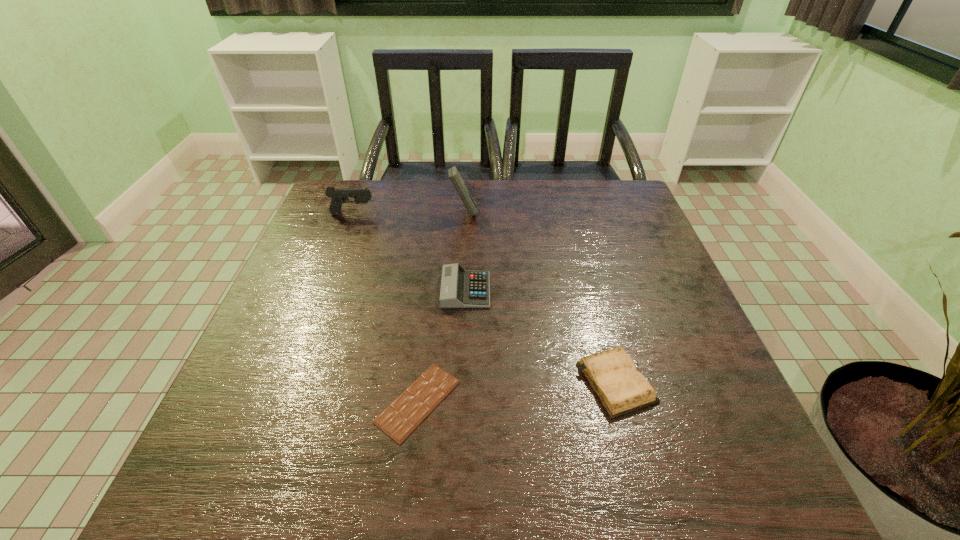
Where is `free space between the chocolate bar and the third tallest object`? This screenshot has height=540, width=960. free space between the chocolate bar and the third tallest object is located at coordinates (442, 346).

At what (x,y) coordinates should I click in order to perform the action: click on vacant area that lies between the pistol and the shorter calculator. Please return your answer as a coordinate pair (x, y). Looking at the image, I should click on (409, 252).

Locate which object is the fourth closest to the second shortest object. Please provide its 2D coordinates. Your answer should be formatted as a tuple, i.e. [(x, y)], where the tuple contains the x and y coordinates of a point satisfying the conditions above.

[(338, 196)]

Where is `object identified as the third closest to the third shortest object`? This screenshot has width=960, height=540. object identified as the third closest to the third shortest object is located at coordinates (456, 179).

Find the location of a particular element. The image size is (960, 540). vacant space that satisfies the following two spatial constraints: 1. at the barrel of the fourth shortest object; 2. on the right side of the third nearest object is located at coordinates (324, 290).

At what (x,y) coordinates should I click in order to perform the action: click on free location that satisfies the following two spatial constraints: 1. on the front-facing side of the rightmost object; 2. on the left side of the tallest object. Please return your answer as a coordinate pair (x, y). Image resolution: width=960 pixels, height=540 pixels. Looking at the image, I should click on (455, 382).

What are the coordinates of `free space that satisfies the following two spatial constraints: 1. on the back side of the second shortest object; 2. on the front-facing side of the tallest object` in the screenshot? It's located at (570, 213).

The height and width of the screenshot is (540, 960). Identify the location of vacant space that satisfies the following two spatial constraints: 1. on the front-facing side of the tallest object; 2. on the right side of the shorter calculator. (460, 290).

Identify the location of free spot that satisfies the following two spatial constraints: 1. at the barrel of the third tallest object; 2. on the right side of the fourth shortest object. The height and width of the screenshot is (540, 960). (324, 290).

Find the location of a particular element. The height and width of the screenshot is (540, 960). vacant space that satisfies the following two spatial constraints: 1. on the front-facing side of the nearer calculator; 2. on the right side of the taller calculator is located at coordinates (460, 290).